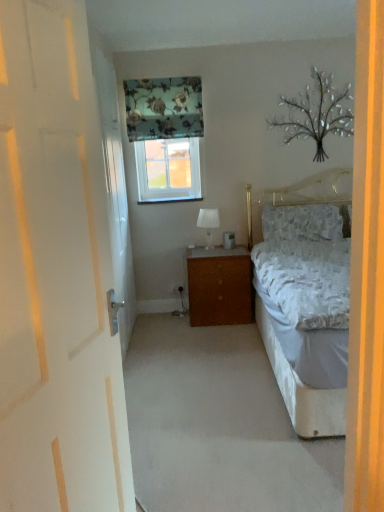
What is the approximate width of fluffy white pillow at center?

23.19 centimeters.

Measure the distance between point (189, 101) and camera.

A distance of 3.73 meters exists between point (189, 101) and camera.

Identify the location of fluffy white pillow at center. (302, 222).

In the image, is clear glass window at upper center on the left side or the right side of white wooden door at left?

In the image, clear glass window at upper center appears on the right side of white wooden door at left.

You are a GUI agent. You are given a task and a screenshot of the screen. Output one action in this format:
    pyautogui.click(x=<x>, y=<y>)
    Task: Click on the door below the clear glass window at upper center (from the image's perspective)
    
    Given the screenshot: What is the action you would take?
    pyautogui.click(x=55, y=274)

Is clear glass window at upper center situated inside white wooden door at left or outside?

clear glass window at upper center is not inside white wooden door at left, it's outside.

Is metallic silver tree at upper right at the back of fluffy white pillow at center?

No, fluffy white pillow at center is not facing the opposite direction of metallic silver tree at upper right.

Which object is positioned more to the left, fluffy white pillow at center or metallic silver tree at upper right?

fluffy white pillow at center.

Considering the positions of point (200, 220) and point (310, 110), is point (200, 220) closer or farther from the camera than point (310, 110)?

Clearly, point (200, 220) is more distant from the camera than point (310, 110).

Does white fabric lampshade at center have a smaller size compared to metallic silver tree at upper right?

Yes, white fabric lampshade at center is smaller than metallic silver tree at upper right.

Where is `tree positioned vertically above the white fabric lampshade at center (from a real-world perspective)`? tree positioned vertically above the white fabric lampshade at center (from a real-world perspective) is located at coordinates [317, 113].

Considering the relative positions of white fabric lampshade at center and metallic silver tree at upper right in the image provided, is white fabric lampshade at center to the left or to the right of metallic silver tree at upper right?

Clearly, white fabric lampshade at center is on the left of metallic silver tree at upper right in the image.

Which is further, (325, 153) or (143, 89)?

The point (325, 153) is more distant.

Considering their positions, is metallic silver tree at upper right located in front of or behind floral fabric curtain at upper center?

In the image, metallic silver tree at upper right appears behind floral fabric curtain at upper center.

Considering the sizes of metallic silver tree at upper right and floral fabric curtain at upper center in the image, is metallic silver tree at upper right taller or shorter than floral fabric curtain at upper center?

Considering their sizes, metallic silver tree at upper right has more height than floral fabric curtain at upper center.

Can you confirm if metallic silver tree at upper right is positioned to the right of floral fabric curtain at upper center?

Yes.

From a real-world perspective, relative to clear glass window at upper center, is floral fabric curtain at upper center vertically above or below?

floral fabric curtain at upper center is situated higher than clear glass window at upper center in the real world.

Which is farther from the camera, (x=198, y=129) or (x=179, y=165)?

The point (x=179, y=165) is farther from the camera.

From the image's perspective, does floral fabric curtain at upper center appear lower than clear glass window at upper center?

Incorrect, from the image's perspective, floral fabric curtain at upper center is higher than clear glass window at upper center.

Considering the sizes of objects floral fabric curtain at upper center and clear glass window at upper center in the image provided, who is shorter, floral fabric curtain at upper center or clear glass window at upper center?

floral fabric curtain at upper center is shorter.

Between clear glass window at upper center and white fabric lampshade at center, which one has smaller width?

clear glass window at upper center is thinner.

From the image's perspective, which one is positioned lower, clear glass window at upper center or white fabric lampshade at center?

white fabric lampshade at center, from the image's perspective.

Does clear glass window at upper center come behind white fabric lampshade at center?

Yes, it is behind white fabric lampshade at center.

Which is closer to the camera, [191,196] or [209,218]?

The point [209,218] is in front.

From a real-world perspective, which is physically above, white fabric lampshade at center or floral fabric curtain at upper center?

floral fabric curtain at upper center, from a real-world perspective.

Which object is thinner, white fabric lampshade at center or floral fabric curtain at upper center?

With smaller width is floral fabric curtain at upper center.

Does white fabric lampshade at center have a larger size compared to floral fabric curtain at upper center?

No, white fabric lampshade at center is not bigger than floral fabric curtain at upper center.

Is white fabric lampshade at center taller than floral fabric curtain at upper center?

In fact, white fabric lampshade at center may be shorter than floral fabric curtain at upper center.

I want to click on window located on the right of white wooden door at left, so click(168, 170).

Image resolution: width=384 pixels, height=512 pixels. Identify the location of pillow behind the metallic silver tree at upper right. (302, 222).

Estimate the real-world distances between objects in this image. Which object is closer to white fabric lampshade at center, floral fabric curtain at upper center or brown wood nightstand at center?

Based on the image, brown wood nightstand at center appears to be nearer to white fabric lampshade at center.

When comparing their distances from brown wood nightstand at center, does white wooden door at left or metallic silver tree at upper right seem further?

Based on the image, white wooden door at left appears to be further to brown wood nightstand at center.

Looking at the image, which one is located further to fluffy white pillow at center, floral fabric curtain at upper center or metallic silver tree at upper right?

Among the two, floral fabric curtain at upper center is located further to fluffy white pillow at center.

From the image, which object appears to be farther from white fabric lampshade at center, fluffy white pillow at center or brown wood nightstand at center?

fluffy white pillow at center is positioned further to the anchor white fabric lampshade at center.

When comparing their distances from white wooden door at left, does metallic silver tree at upper right or clear glass window at upper center seem further?

Among the two, metallic silver tree at upper right is located further to white wooden door at left.

Considering their positions, is white fabric lampshade at center positioned further to fluffy white pillow at center than white wooden door at left?

white wooden door at left is positioned further to the anchor fluffy white pillow at center.

Based on their spatial positions, is fluffy white pillow at center or white wooden door at left closer to floral fabric curtain at upper center?

fluffy white pillow at center is positioned closer to the anchor floral fabric curtain at upper center.

Based on their spatial positions, is floral fabric curtain at upper center or fluffy white pillow at center further from brown wood nightstand at center?

The object further to brown wood nightstand at center is floral fabric curtain at upper center.

Where is `nightstand between white fabric lampshade at center and fluffy white pillow at center`? nightstand between white fabric lampshade at center and fluffy white pillow at center is located at coordinates (220, 286).

Locate an element on the screen. The height and width of the screenshot is (512, 384). pillow that lies between metallic silver tree at upper right and white fabric lampshade at center from top to bottom is located at coordinates (302, 222).

Where is `pillow located between white wooden door at left and white fabric lampshade at center in the depth direction`? The image size is (384, 512). pillow located between white wooden door at left and white fabric lampshade at center in the depth direction is located at coordinates (302, 222).

This screenshot has width=384, height=512. I want to click on curtain located between white wooden door at left and white fabric lampshade at center in the depth direction, so [x=163, y=108].